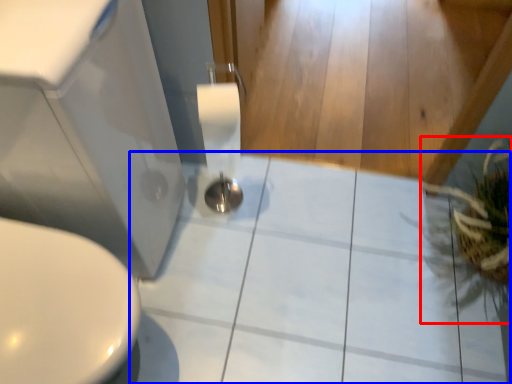
Question: Which of the following is the farthest to the observer, plant (highlighted by a red box) or ceramic tile (highlighted by a blue box)?

Choices:
 (A) plant
 (B) ceramic tile

Answer: (B)